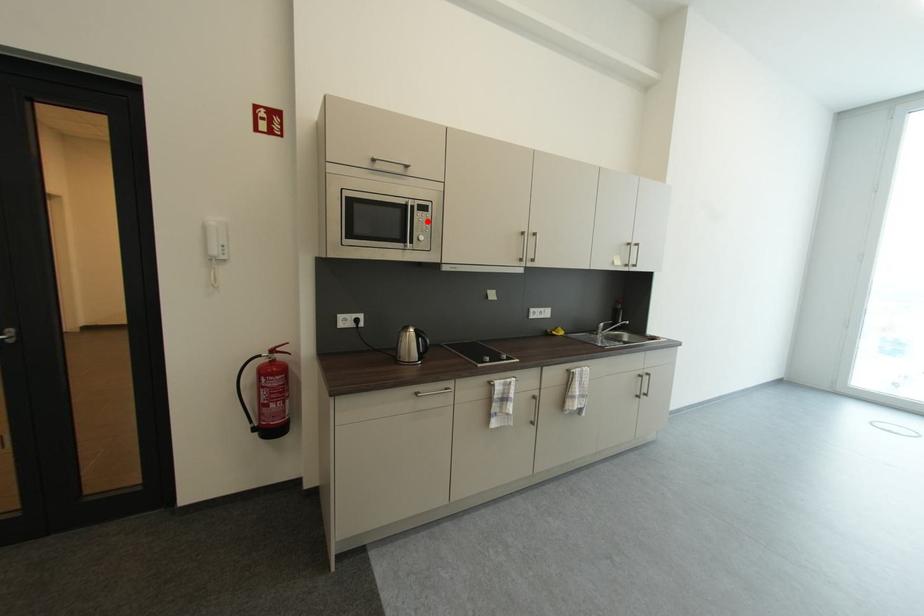
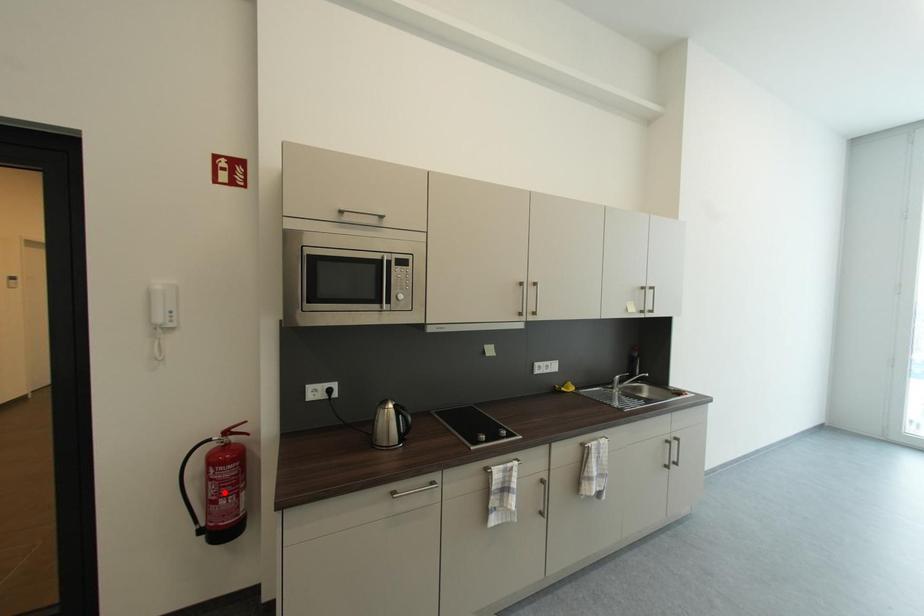
I am providing you with two images of the same scene from different viewpoints. A red point is marked on the first image and another point is marked on the second image. Does the point marked in image1 correspond to the same location as the one in image2?

No